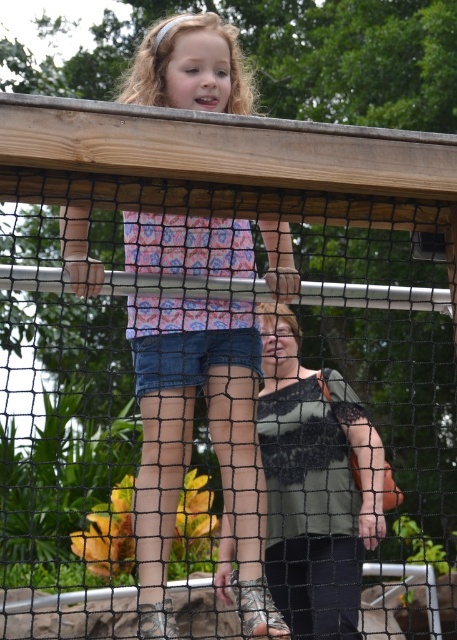
Question: Which object is farther from the camera taking this photo?

Choices:
 (A) green lace tank top at center
 (B) matte pink shirt at upper center

Answer: (A)

Question: Can you confirm if matte pink shirt at upper center is positioned below green lace tank top at center?

Choices:
 (A) no
 (B) yes

Answer: (A)

Question: Considering the relative positions of matte pink shirt at upper center and green lace tank top at center in the image provided, where is matte pink shirt at upper center located with respect to green lace tank top at center?

Choices:
 (A) above
 (B) below

Answer: (A)

Question: Which point is farther to the camera?

Choices:
 (A) (330, 371)
 (B) (249, 468)

Answer: (A)

Question: Does matte pink shirt at upper center lie in front of green lace tank top at center?

Choices:
 (A) yes
 (B) no

Answer: (A)